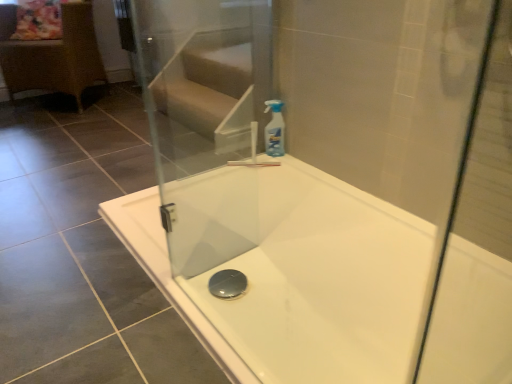
Consider the image. Measure the distance between point (367, 194) and camera.

A distance of 5.56 feet exists between point (367, 194) and camera.

Measure the distance between rattan wicker chair at left and camera.

A distance of 8.56 feet exists between rattan wicker chair at left and camera.

The height and width of the screenshot is (384, 512). Describe the element at coordinates (53, 55) in the screenshot. I see `rattan wicker chair at left` at that location.

Identify the location of transparent plastic spray bottle at upper right. The width and height of the screenshot is (512, 384). (274, 129).

Is the depth of white glossy bathtub at center less than that of transparent plastic spray bottle at upper right?

Yes.

Where is `bathtub in front of the transparent plastic spray bottle at upper right`? The height and width of the screenshot is (384, 512). bathtub in front of the transparent plastic spray bottle at upper right is located at coordinates point(302,281).

From a real-world perspective, between white glossy bathtub at center and transparent plastic spray bottle at upper right, who is vertically lower?

white glossy bathtub at center, from a real-world perspective.

Considering the relative sizes of white glossy bathtub at center and transparent plastic spray bottle at upper right in the image provided, is white glossy bathtub at center smaller than transparent plastic spray bottle at upper right?

No, white glossy bathtub at center is not smaller than transparent plastic spray bottle at upper right.

You are a GUI agent. You are given a task and a screenshot of the screen. Output one action in this format:
    pyautogui.click(x=<x>, y=<y>)
    Task: Click on the screen door above the transparent plastic spray bottle at upper right (from a real-world perspective)
    The image size is (512, 384).
    Given the screenshot: What is the action you would take?
    pyautogui.click(x=204, y=120)

From a real-world perspective, is transparent glass screen door at upper center under transparent plastic spray bottle at upper right?

No, from a real-world perspective, transparent glass screen door at upper center is not below transparent plastic spray bottle at upper right.

From their relative heights in the image, would you say transparent glass screen door at upper center is taller or shorter than transparent plastic spray bottle at upper right?

Considering their sizes, transparent glass screen door at upper center has more height than transparent plastic spray bottle at upper right.

Is white glossy bathtub at center turned away from rattan wicker chair at left?

No, white glossy bathtub at center is not facing away from rattan wicker chair at left.

Would you say white glossy bathtub at center is a long distance from rattan wicker chair at left?

That's right, there is a large distance between white glossy bathtub at center and rattan wicker chair at left.

From the image's perspective, is white glossy bathtub at center over rattan wicker chair at left?

No.

Looking at this image, considering the positions of objects white glossy bathtub at center and transparent glass screen door at upper center in the image provided, who is more to the left, white glossy bathtub at center or transparent glass screen door at upper center?

Positioned to the left is transparent glass screen door at upper center.

Can you confirm if white glossy bathtub at center is shorter than transparent glass screen door at upper center?

Correct, white glossy bathtub at center is not as tall as transparent glass screen door at upper center.

From a real-world perspective, which is physically above, white glossy bathtub at center or transparent glass screen door at upper center?

From a 3D spatial view, transparent glass screen door at upper center is above.

Which is more to the right, transparent plastic spray bottle at upper right or white glossy bathtub at center?

From the viewer's perspective, white glossy bathtub at center appears more on the right side.

Image resolution: width=512 pixels, height=384 pixels. Identify the location of bathtub on the right of transparent plastic spray bottle at upper right. (302, 281).

Considering the sizes of objects transparent plastic spray bottle at upper right and white glossy bathtub at center in the image provided, who is bigger, transparent plastic spray bottle at upper right or white glossy bathtub at center?

Bigger between the two is white glossy bathtub at center.

Does transparent plastic spray bottle at upper right have a lesser height compared to white glossy bathtub at center?

No, transparent plastic spray bottle at upper right is not shorter than white glossy bathtub at center.

At what (x,y) coordinates should I click in order to perform the action: click on furniture lying above the white glossy bathtub at center (from the image's perspective). Please return your answer as a coordinate pair (x, y). Looking at the image, I should click on (53, 55).

In terms of width, does rattan wicker chair at left look wider or thinner when compared to white glossy bathtub at center?

Clearly, rattan wicker chair at left has less width compared to white glossy bathtub at center.

From the image's perspective, is rattan wicker chair at left under white glossy bathtub at center?

No, from the image's perspective, rattan wicker chair at left is not below white glossy bathtub at center.

Is rattan wicker chair at left turned away from white glossy bathtub at center?

rattan wicker chair at left is not turned away from white glossy bathtub at center.

In terms of height, does transparent plastic spray bottle at upper right look taller or shorter compared to rattan wicker chair at left?

In the image, transparent plastic spray bottle at upper right appears to be shorter than rattan wicker chair at left.

Choose the correct answer: Is transparent plastic spray bottle at upper right inside rattan wicker chair at left or outside it?

transparent plastic spray bottle at upper right is not inside rattan wicker chair at left, it's outside.

Considering the positions of objects transparent plastic spray bottle at upper right and rattan wicker chair at left in the image provided, who is more to the right, transparent plastic spray bottle at upper right or rattan wicker chair at left?

From the viewer's perspective, transparent plastic spray bottle at upper right appears more on the right side.

From the image's perspective, does transparent plastic spray bottle at upper right appear lower than rattan wicker chair at left?

Indeed, from the image's perspective, transparent plastic spray bottle at upper right is shown beneath rattan wicker chair at left.

The image size is (512, 384). Find the location of `cleaning product above the white glossy bathtub at center (from a real-world perspective)`. cleaning product above the white glossy bathtub at center (from a real-world perspective) is located at coordinates (274, 129).

Where is `screen door on the left of transparent plastic spray bottle at upper right`? This screenshot has height=384, width=512. screen door on the left of transparent plastic spray bottle at upper right is located at coordinates (204, 120).

Consider the image. Which object lies further to the anchor point rattan wicker chair at left, white glossy bathtub at center or transparent glass screen door at upper center?

Among the two, white glossy bathtub at center is located further to rattan wicker chair at left.

From the image, which object appears to be farther from transparent plastic spray bottle at upper right, rattan wicker chair at left or white glossy bathtub at center?

The object further to transparent plastic spray bottle at upper right is rattan wicker chair at left.

Based on their spatial positions, is transparent plastic spray bottle at upper right or white glossy bathtub at center further from transparent glass screen door at upper center?

transparent plastic spray bottle at upper right is positioned further to the anchor transparent glass screen door at upper center.

From the image, which object appears to be farther from transparent plastic spray bottle at upper right, rattan wicker chair at left or transparent glass screen door at upper center?

rattan wicker chair at left.

Considering their positions, is transparent plastic spray bottle at upper right positioned further to rattan wicker chair at left than white glossy bathtub at center?

Based on the image, white glossy bathtub at center appears to be further to rattan wicker chair at left.

Estimate the real-world distances between objects in this image. Which object is closer to transparent glass screen door at upper center, white glossy bathtub at center or transparent plastic spray bottle at upper right?

Among the two, white glossy bathtub at center is located nearer to transparent glass screen door at upper center.

Based on their spatial positions, is white glossy bathtub at center or rattan wicker chair at left closer to transparent glass screen door at upper center?

white glossy bathtub at center.

Which object lies nearer to the anchor point white glossy bathtub at center, transparent plastic spray bottle at upper right or rattan wicker chair at left?

The object closer to white glossy bathtub at center is transparent plastic spray bottle at upper right.

This screenshot has width=512, height=384. I want to click on screen door between rattan wicker chair at left and transparent plastic spray bottle at upper right in the horizontal direction, so click(x=204, y=120).

What are the coordinates of `cleaning product positioned between white glossy bathtub at center and rattan wicker chair at left from near to far` in the screenshot? It's located at click(x=274, y=129).

Where is `screen door located between white glossy bathtub at center and transparent plastic spray bottle at upper right in the depth direction`? The height and width of the screenshot is (384, 512). screen door located between white glossy bathtub at center and transparent plastic spray bottle at upper right in the depth direction is located at coordinates 204,120.

Find the location of a particular element. screen door positioned between white glossy bathtub at center and rattan wicker chair at left from near to far is located at coordinates (204, 120).